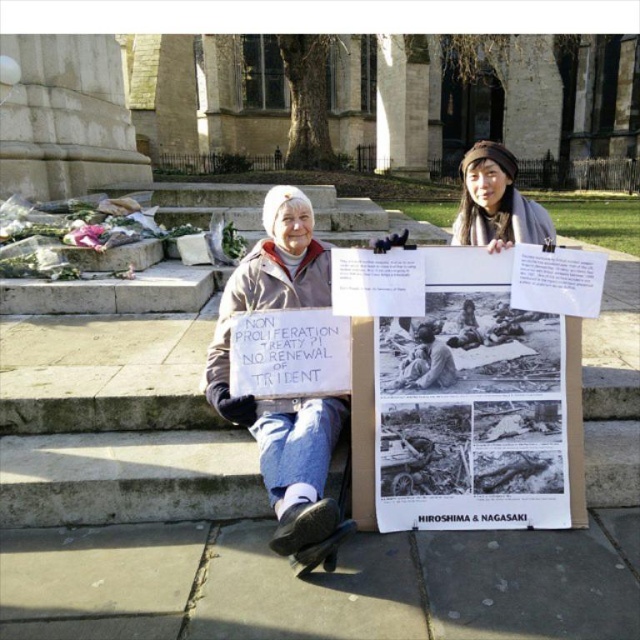
Question: Which point is farther to the camera?

Choices:
 (A) pos(522,241)
 (B) pos(426,368)

Answer: (A)

Question: Is black paper poster at center behind denim jacket at center?

Choices:
 (A) yes
 (B) no

Answer: (A)

Question: Which of these objects is positioned closest to the denim jacket at center?

Choices:
 (A) black paper poster at center
 (B) brown woolen hat at upper center
 (C) black and white photograph of man at center

Answer: (C)

Question: Which point appears farthest from the camera in this image?

Choices:
 (A) (534, 202)
 (B) (214, 360)
 (C) (442, 353)

Answer: (A)

Question: Considering the relative positions of brown woolen hat at upper center and black and white photograph of man at center in the image provided, where is brown woolen hat at upper center located with respect to black and white photograph of man at center?

Choices:
 (A) above
 (B) below

Answer: (A)

Question: Does brown woolen hat at upper center have a smaller size compared to black and white photograph of man at center?

Choices:
 (A) no
 (B) yes

Answer: (A)